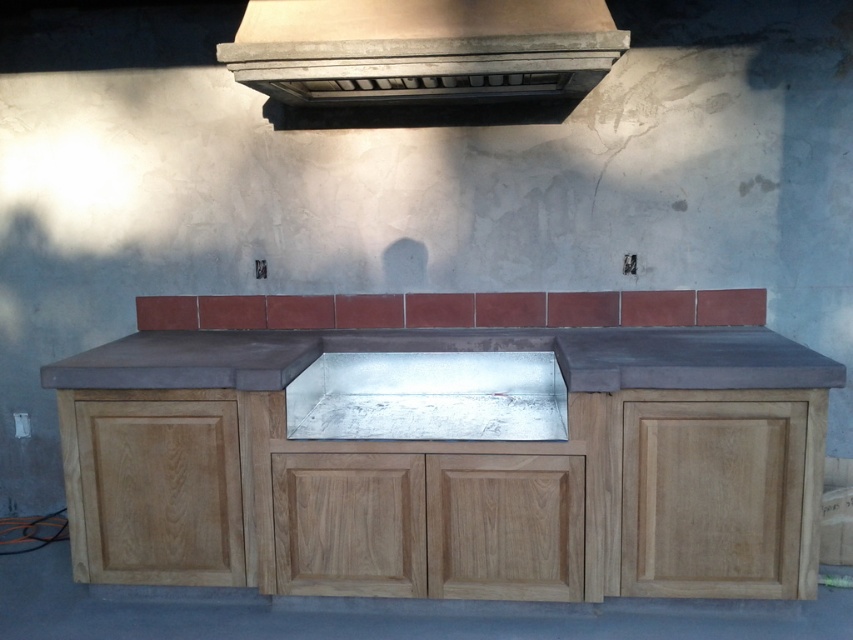
Question: Estimate the real-world distances between objects in this image. Which object is farther from the concrete countertop at center?

Choices:
 (A) silver metallic sink at center
 (B) gray concrete counter at center
 (C) concrete textured vent at upper center

Answer: (C)

Question: Does concrete countertop at center have a larger size compared to silver metallic sink at center?

Choices:
 (A) yes
 (B) no

Answer: (A)

Question: Which point is farther from the camera taking this photo?

Choices:
 (A) click(149, 481)
 (B) click(508, 38)
 (C) click(146, 346)
 (D) click(302, 387)

Answer: (C)

Question: Is the position of concrete countertop at center less distant than that of silver metallic sink at center?

Choices:
 (A) no
 (B) yes

Answer: (B)

Question: Is concrete countertop at center smaller than concrete textured vent at upper center?

Choices:
 (A) yes
 (B) no

Answer: (B)

Question: Estimate the real-world distances between objects in this image. Which object is closer to the concrete textured vent at upper center?

Choices:
 (A) concrete countertop at center
 (B) gray concrete counter at center

Answer: (B)